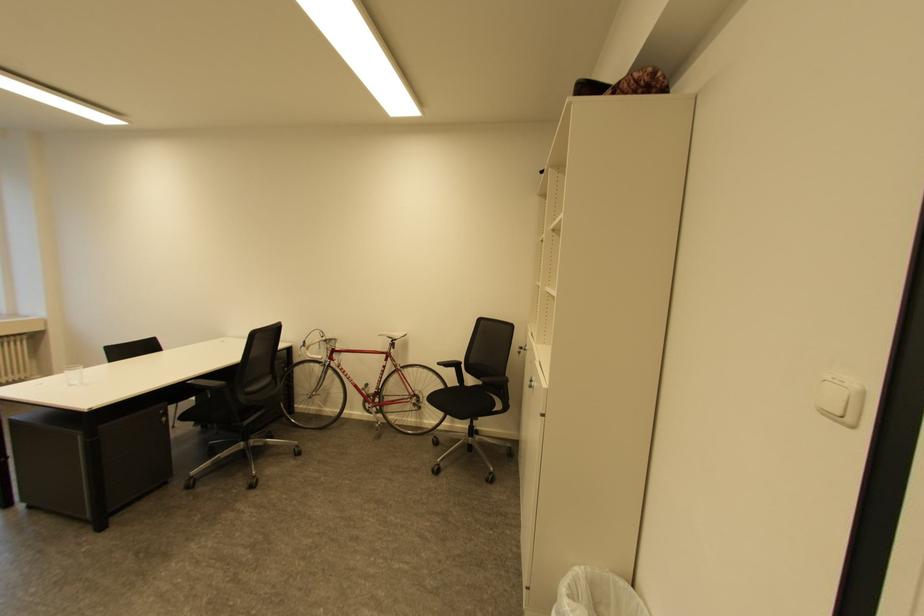
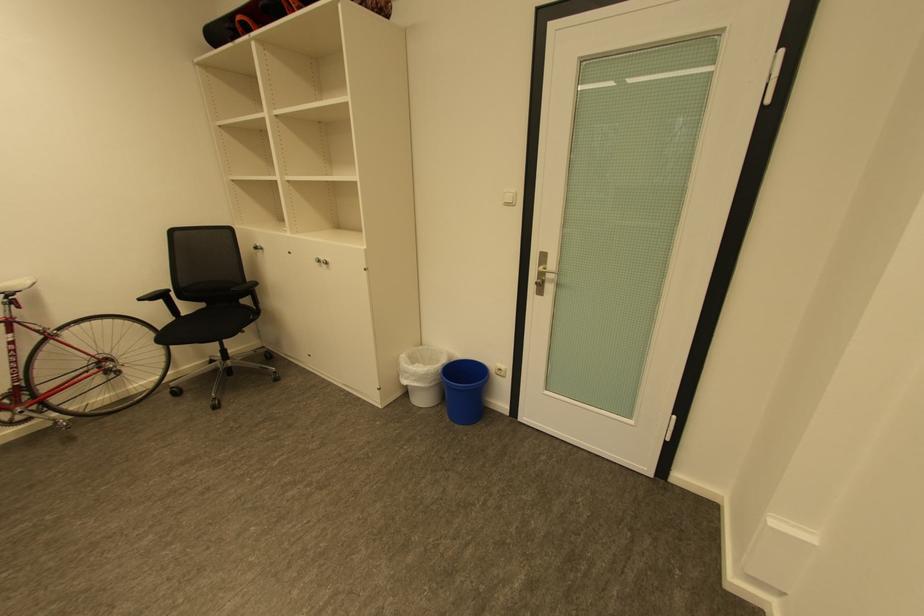
Where in the second image is the point corresponding to (x=445, y=363) from the first image?

(148, 300)